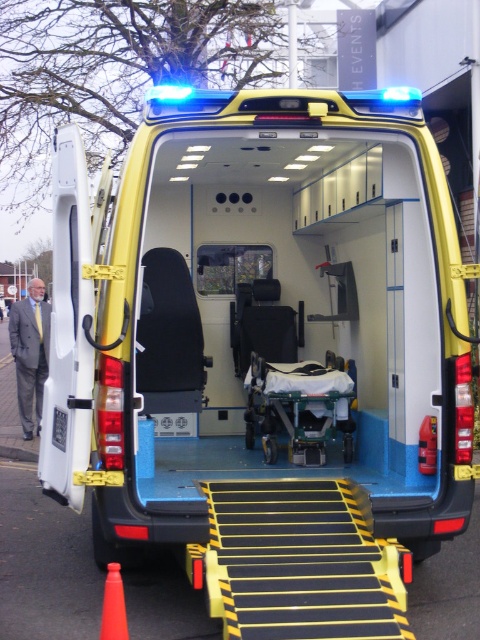
Who is shorter, metallic green stretcher at center or orange plastic cone at lower left?

With less height is orange plastic cone at lower left.

Is metallic green stretcher at center taller than orange plastic cone at lower left?

Yes, metallic green stretcher at center is taller than orange plastic cone at lower left.

Does point (311, 364) come closer to viewer compared to point (106, 632)?

That is False.

I want to click on metallic green stretcher at center, so click(x=300, y=406).

Between yellow matte ambulance at center and metallic green stretcher at center, which one is positioned higher?

yellow matte ambulance at center

Measure the distance between point (398, 536) and camera.

Point (398, 536) and camera are 3.98 meters apart.

Find the location of a particular element. This screenshot has width=480, height=640. yellow matte ambulance at center is located at coordinates (261, 316).

Measure the distance from yellow matte ambulance at center to orange plastic cone at lower left.

They are 7.74 feet apart.

Locate an element on the screen. yellow matte ambulance at center is located at coordinates (261, 316).